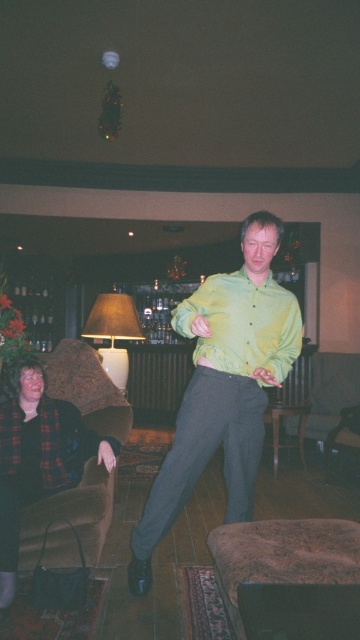
Question: Can you confirm if velvet brown couch at lower left is positioned to the right of green shiny shirt at center?

Choices:
 (A) no
 (B) yes

Answer: (A)

Question: Observing the image, what is the correct spatial positioning of green matte shirt at center in reference to velvet brown couch at lower left?

Choices:
 (A) below
 (B) above

Answer: (B)

Question: Does velvet brown couch at lower left appear on the left side of green shiny shirt at center?

Choices:
 (A) no
 (B) yes

Answer: (B)

Question: Which object is positioned farthest from the green matte shirt at center?

Choices:
 (A) velvet brown couch at lower left
 (B) green shiny shirt at center

Answer: (A)

Question: Which point is closer to the camera?

Choices:
 (A) click(x=125, y=432)
 (B) click(x=267, y=337)
 (C) click(x=271, y=340)

Answer: (B)

Question: Which object is farther from the camera taking this photo?

Choices:
 (A) velvet brown couch at lower left
 (B) green shiny shirt at center

Answer: (A)